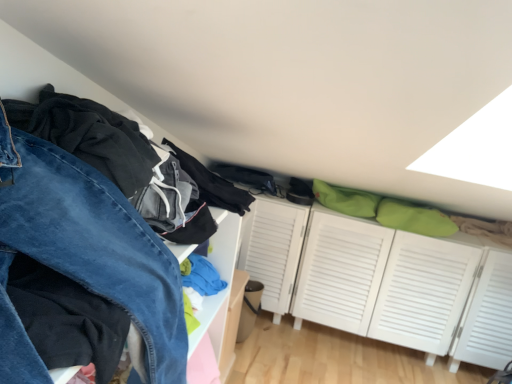
Question: Is white louvered cabinet at center spatially inside denim pants at left, or outside of it?

Choices:
 (A) inside
 (B) outside

Answer: (B)

Question: From the image's perspective, is white louvered cabinet at center located above or below denim pants at left?

Choices:
 (A) below
 (B) above

Answer: (B)

Question: In terms of size, does white louvered cabinet at center appear bigger or smaller than denim pants at left?

Choices:
 (A) big
 (B) small

Answer: (A)

Question: Considering the positions of denim pants at left and white louvered cabinet at center in the image, is denim pants at left bigger or smaller than white louvered cabinet at center?

Choices:
 (A) big
 (B) small

Answer: (B)

Question: Considering the positions of denim pants at left and white louvered cabinet at center in the image, is denim pants at left taller or shorter than white louvered cabinet at center?

Choices:
 (A) short
 (B) tall

Answer: (B)

Question: Considering the positions of point (151, 273) and point (436, 334), is point (151, 273) closer or farther from the camera than point (436, 334)?

Choices:
 (A) closer
 (B) farther

Answer: (A)

Question: Is denim pants at left in front of or behind white louvered cabinet at center in the image?

Choices:
 (A) front
 (B) behind

Answer: (A)